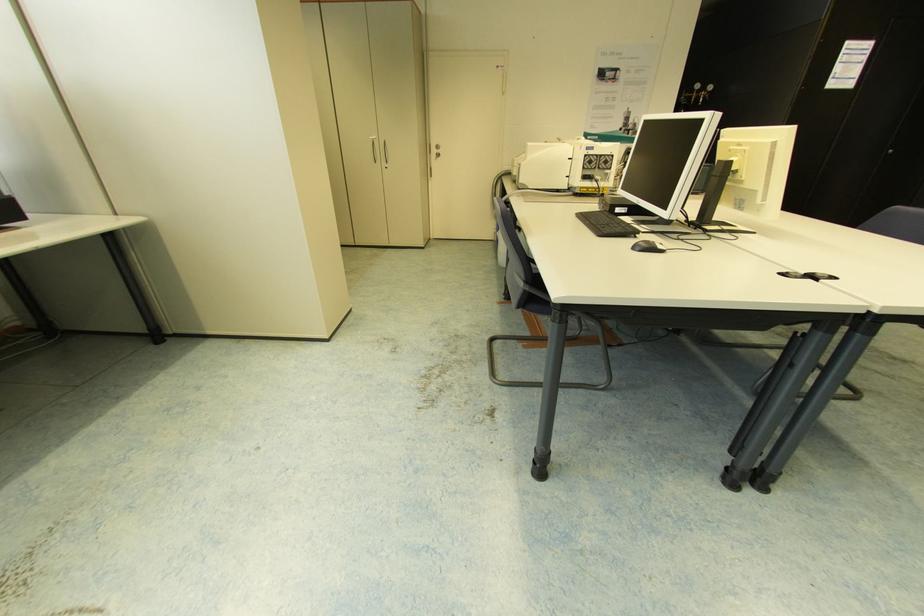
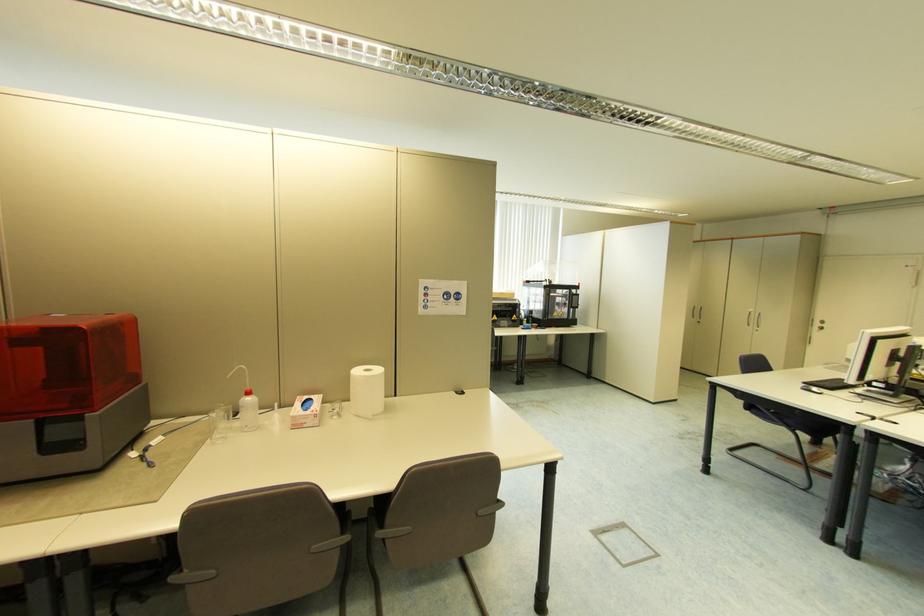
The point at (x=438, y=151) is marked in the first image. Where is the corresponding point in the second image?

(821, 325)